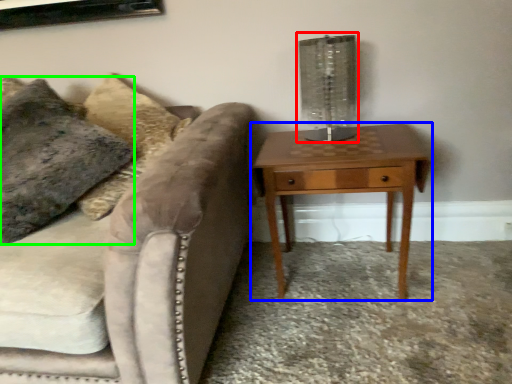
Question: Which object is positioned closest to table lamp (highlighted by a red box)? Select from nightstand (highlighted by a blue box) and pillow (highlighted by a green box).

Choices:
 (A) nightstand
 (B) pillow

Answer: (A)